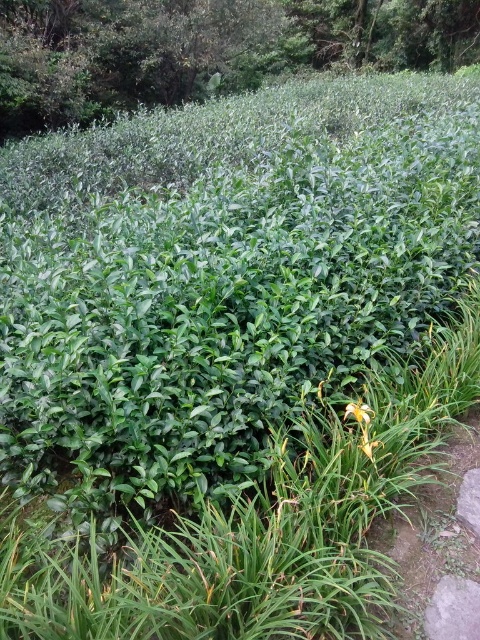
Can you confirm if green leafy bush at upper center is shorter than yellow matte flower at lower right?

No.

Does green leafy bush at upper center appear on the left side of yellow matte flower at lower right?

Yes, green leafy bush at upper center is to the left of yellow matte flower at lower right.

Is point (259, 61) positioned before point (363, 420)?

No, (259, 61) is behind (363, 420).

You are a GUI agent. You are given a task and a screenshot of the screen. Output one action in this format:
    pyautogui.click(x=<x>, y=<y>)
    Task: Click on the green leafy bush at upper center
    The width and height of the screenshot is (480, 640).
    Given the screenshot: What is the action you would take?
    pyautogui.click(x=204, y=49)

Who is positioned more to the left, yellow matte flower at lower right or yellow matte flower at lower center?

From the viewer's perspective, yellow matte flower at lower right appears more on the left side.

Which is in front, point (356, 412) or point (370, 448)?

Point (370, 448) is in front.

The image size is (480, 640). Identify the location of yellow matte flower at lower right. (359, 412).

Between green leafy bush at upper center and yellow matte flower at lower center, which one appears on the right side from the viewer's perspective?

Positioned to the right is yellow matte flower at lower center.

Is green leafy bush at upper center to the right of yellow matte flower at lower center from the viewer's perspective?

No, green leafy bush at upper center is not to the right of yellow matte flower at lower center.

Between point (414, 12) and point (363, 449), which one is positioned in front?

Positioned in front is point (363, 449).

You are a GUI agent. You are given a task and a screenshot of the screen. Output one action in this format:
    pyautogui.click(x=<x>, y=<y>)
    Task: Click on the green leafy bush at upper center
    The height and width of the screenshot is (640, 480).
    Given the screenshot: What is the action you would take?
    pyautogui.click(x=204, y=49)